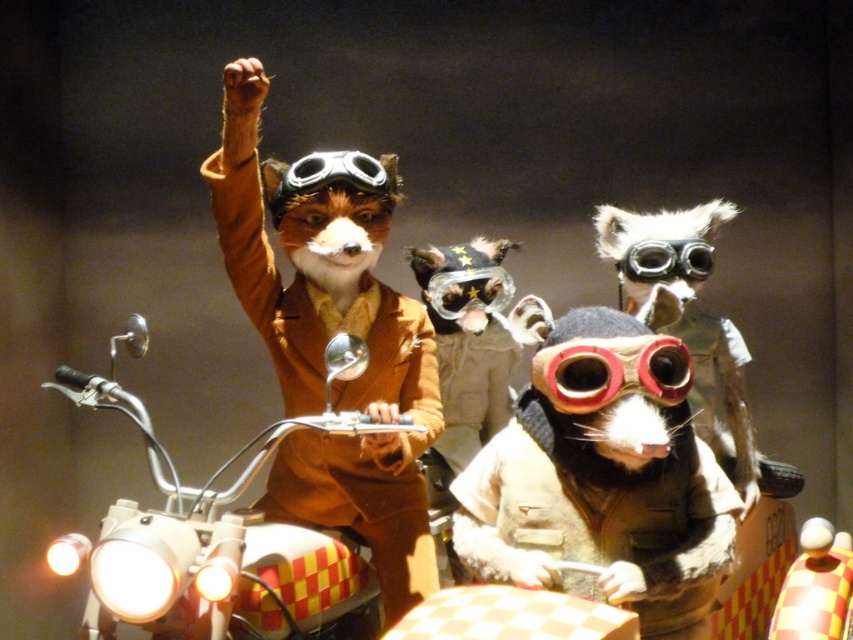
Question: Based on their relative distances, which object is nearer to the rubberized red goggles at center?

Choices:
 (A) shiny metallic goggles at center
 (B) fuzzy beige vest at center
 (C) metallic chrome motorcycle at center

Answer: (B)

Question: Can you confirm if metallic chrome motorcycle at center is positioned to the left of rubberized red goggles at center?

Choices:
 (A) no
 (B) yes

Answer: (B)

Question: Which point appears farthest from the camera in this image?

Choices:
 (A) (660, 275)
 (B) (561, 582)
 (C) (137, 564)
 (D) (576, 378)

Answer: (A)

Question: Is fuzzy beige vest at center positioned behind shiny metallic goggles at center?

Choices:
 (A) no
 (B) yes

Answer: (A)

Question: Which object is positioned closest to the fuzzy beige vest at center?

Choices:
 (A) rubberized red goggles at center
 (B) metallic chrome motorcycle at center

Answer: (A)

Question: Is fuzzy beige vest at center positioned before rubberized red goggles at center?

Choices:
 (A) no
 (B) yes

Answer: (B)